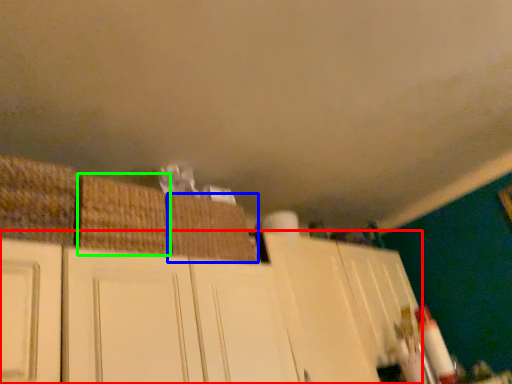
Question: Which is nearer to the cabinetry (highlighted by a red box)? basket (highlighted by a blue box) or basket (highlighted by a green box).

Choices:
 (A) basket
 (B) basket

Answer: (A)